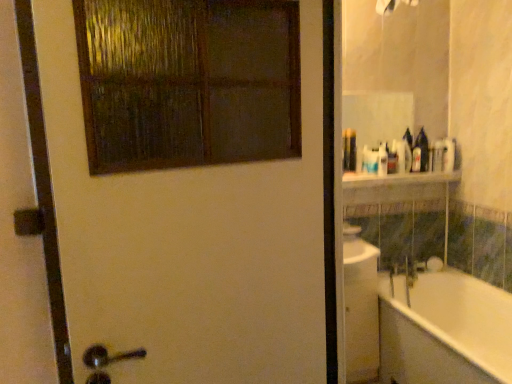
Question: From the image's perspective, is white glossy bathtub at right below white matte door at upper left?

Choices:
 (A) yes
 (B) no

Answer: (A)

Question: Considering the relative sizes of white glossy bathtub at right and white matte door at upper left in the image provided, is white glossy bathtub at right bigger than white matte door at upper left?

Choices:
 (A) no
 (B) yes

Answer: (B)

Question: Considering the relative sizes of white glossy bathtub at right and white matte door at upper left in the image provided, is white glossy bathtub at right wider than white matte door at upper left?

Choices:
 (A) no
 (B) yes

Answer: (B)

Question: Can you confirm if white glossy bathtub at right is taller than white matte door at upper left?

Choices:
 (A) no
 (B) yes

Answer: (A)

Question: Is white glossy bathtub at right not within white matte door at upper left?

Choices:
 (A) yes
 (B) no

Answer: (A)

Question: From the image's perspective, is white matte door at upper left positioned above or below translucent plastic bottle at upper right?

Choices:
 (A) above
 (B) below

Answer: (B)

Question: Considering the positions of point (103, 332) and point (393, 152), is point (103, 332) closer or farther from the camera than point (393, 152)?

Choices:
 (A) farther
 (B) closer

Answer: (B)

Question: From a real-world perspective, is white matte door at upper left above or below translucent plastic bottle at upper right?

Choices:
 (A) below
 (B) above

Answer: (A)

Question: In terms of size, does white matte door at upper left appear bigger or smaller than translucent plastic bottle at upper right?

Choices:
 (A) big
 (B) small

Answer: (A)

Question: Is point (392, 155) positioned closer to the camera than point (350, 175)?

Choices:
 (A) farther
 (B) closer

Answer: (A)

Question: Is translucent plastic bottle at upper right wider or thinner than white glossy shelf at upper center?

Choices:
 (A) wide
 (B) thin

Answer: (B)

Question: Would you say translucent plastic bottle at upper right is inside or outside white glossy shelf at upper center?

Choices:
 (A) inside
 (B) outside

Answer: (B)

Question: From a real-world perspective, is translucent plastic bottle at upper right physically located above or below white glossy shelf at upper center?

Choices:
 (A) below
 (B) above

Answer: (B)

Question: Is white glossy bathtub at right in front of or behind white glossy shelf at upper center in the image?

Choices:
 (A) behind
 (B) front

Answer: (B)

Question: From the image's perspective, relative to white glossy shelf at upper center, is white glossy bathtub at right above or below?

Choices:
 (A) below
 (B) above

Answer: (A)